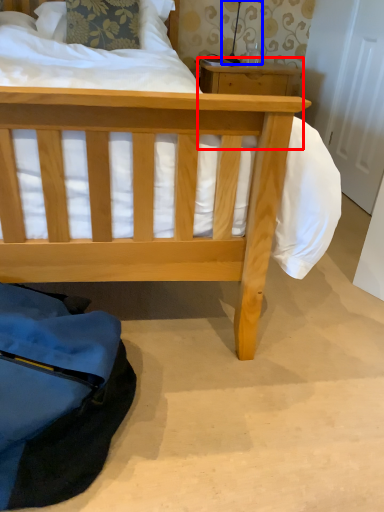
Question: Among these objects, which one is farthest to the camera, table (highlighted by a red box) or table lamp (highlighted by a blue box)?

Choices:
 (A) table
 (B) table lamp

Answer: (B)